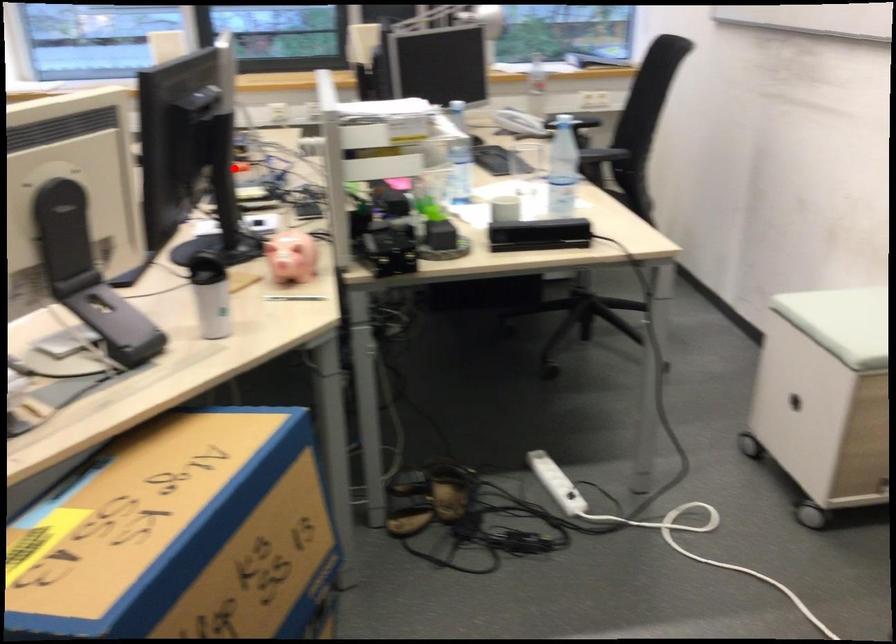
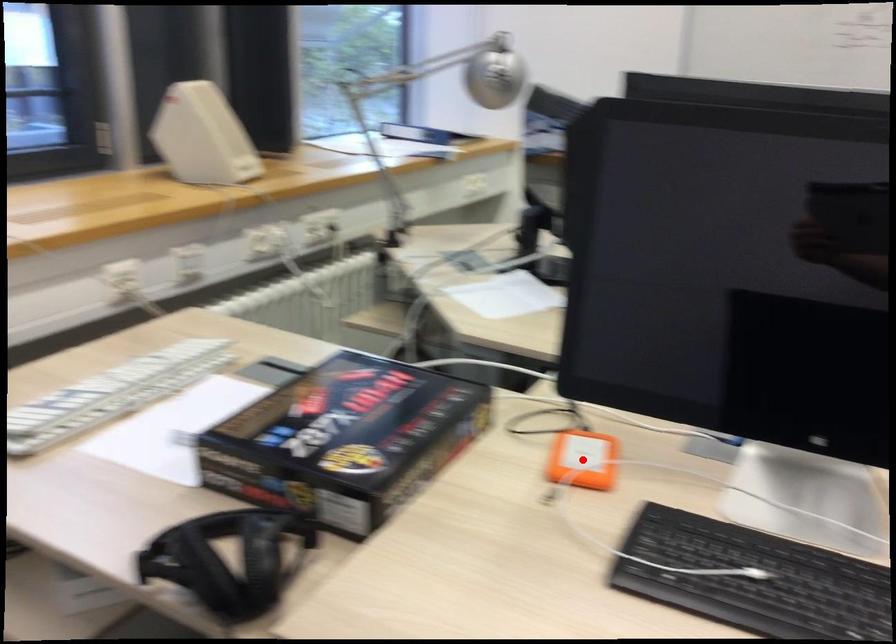
I am providing you with two images of the same scene from different viewpoints. A red point is marked on the first image and another point is marked on the second image. Is the red point in image1 aligned with the point shown in image2?

Yes